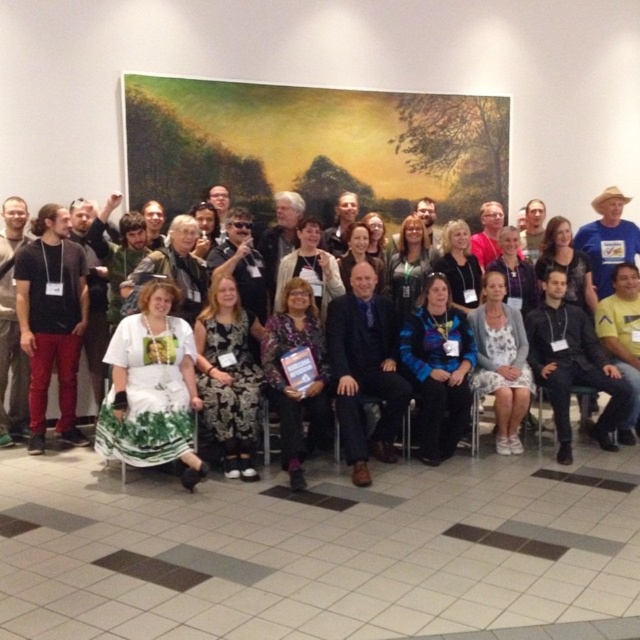
Question: Can you confirm if white lace dress at center is positioned above white printed dress at lower left?

Choices:
 (A) no
 (B) yes

Answer: (B)

Question: From the image, what is the correct spatial relationship of white lace dress at center in relation to white printed dress at lower left?

Choices:
 (A) right
 (B) left

Answer: (B)

Question: Which point is farther to the camera?

Choices:
 (A) white lace dress at center
 (B) white printed dress at lower left

Answer: (A)

Question: Does white lace dress at center have a smaller size compared to white printed dress at lower left?

Choices:
 (A) no
 (B) yes

Answer: (A)

Question: Which of the following is the farthest from the observer?

Choices:
 (A) (163, 300)
 (B) (13, 420)

Answer: (B)

Question: Which point is farther to the camera?

Choices:
 (A) white printed dress at lower left
 (B) white lace dress at center

Answer: (B)